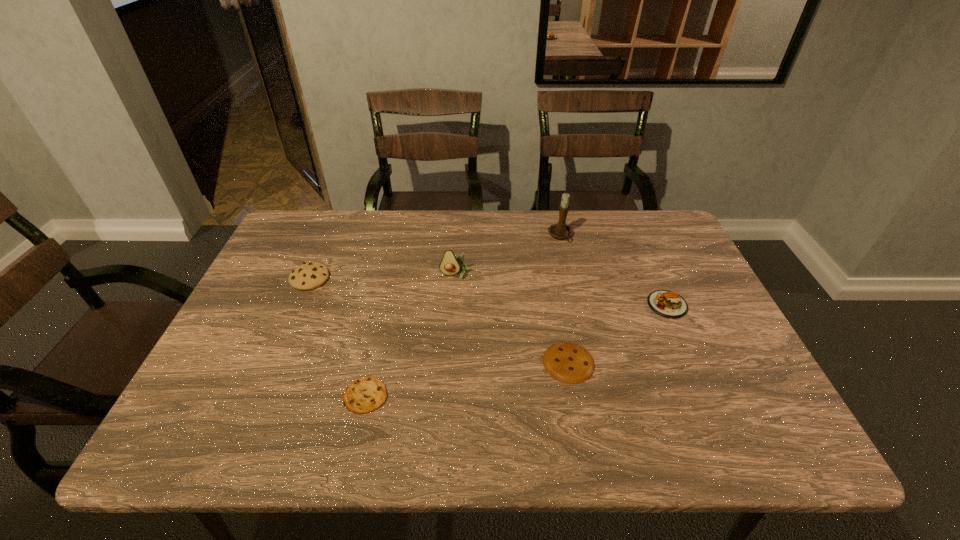
Where is `the farthest object`? the farthest object is located at coordinates (560, 230).

This screenshot has width=960, height=540. I want to click on candle holder, so click(560, 230).

Find the location of a particular element. avocado is located at coordinates (450, 265).

Locate an element on the screen. the fifth shortest object is located at coordinates (450, 265).

At what (x,y) coordinates should I click in order to perform the action: click on the leftmost object. Please return your answer as a coordinate pair (x, y). Looking at the image, I should click on (311, 275).

Image resolution: width=960 pixels, height=540 pixels. Identify the location of the leftmost cookie. (311, 275).

Image resolution: width=960 pixels, height=540 pixels. I want to click on patty (food), so click(668, 304).

The image size is (960, 540). I want to click on the rightmost cookie, so click(x=567, y=362).

Identify the location of the second cookie from right to left. The image size is (960, 540). (366, 394).

You are a GUI agent. You are given a task and a screenshot of the screen. Output one action in this format:
    pyautogui.click(x=<x>, y=<y>)
    Task: Click on the blank space located on the side of the candle holder with the handle
    This screenshot has width=960, height=540.
    Given the screenshot: What is the action you would take?
    pos(570,279)